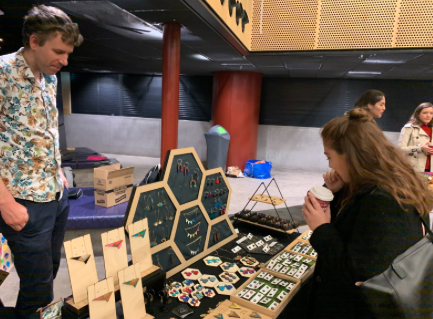
The image size is (433, 319). What are the coordinates of `honeycomb-shaped display` in the screenshot? It's located at (194, 201).